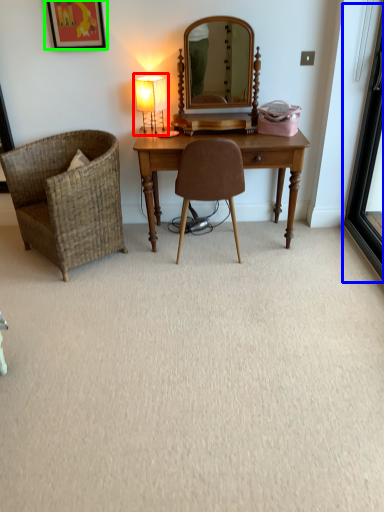
Question: Which is nearer to the table lamp (highlighted by a red box)? screen door (highlighted by a blue box) or picture frame (highlighted by a green box).

Choices:
 (A) screen door
 (B) picture frame

Answer: (B)